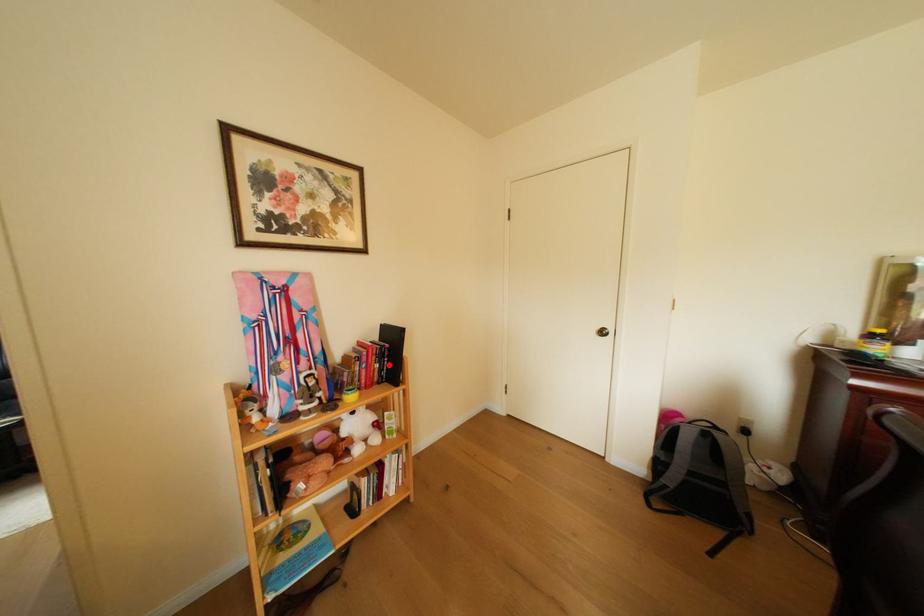
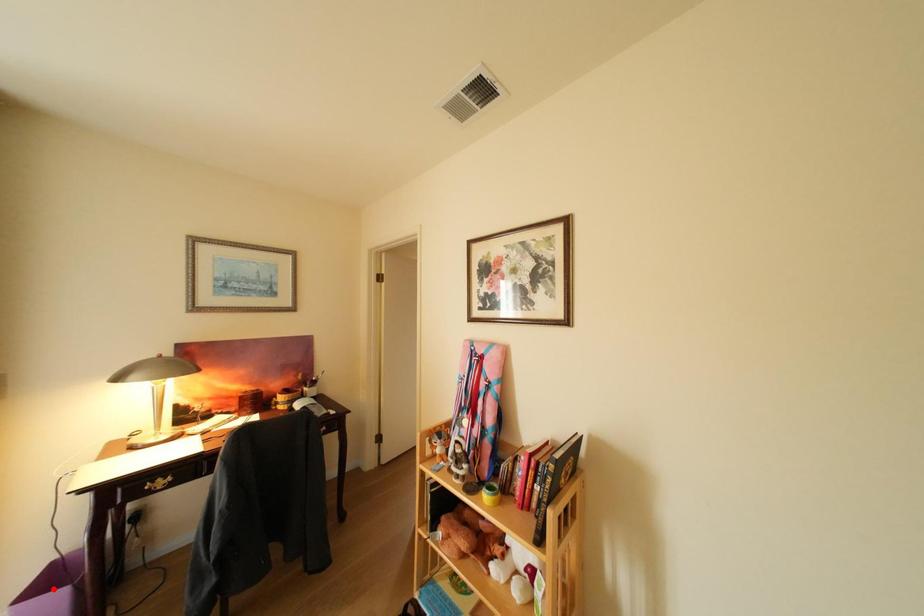
I am providing you with two images of the same scene from different viewpoints. A red point is marked on the first image and another point is marked on the second image. Do the highlighted points in image1 and image2 indicate the same real-world spot?

No